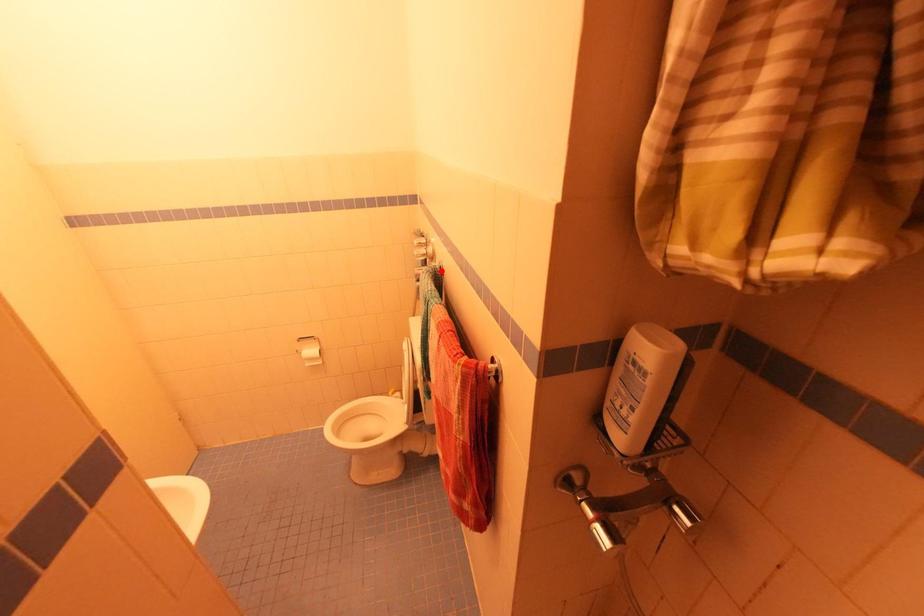
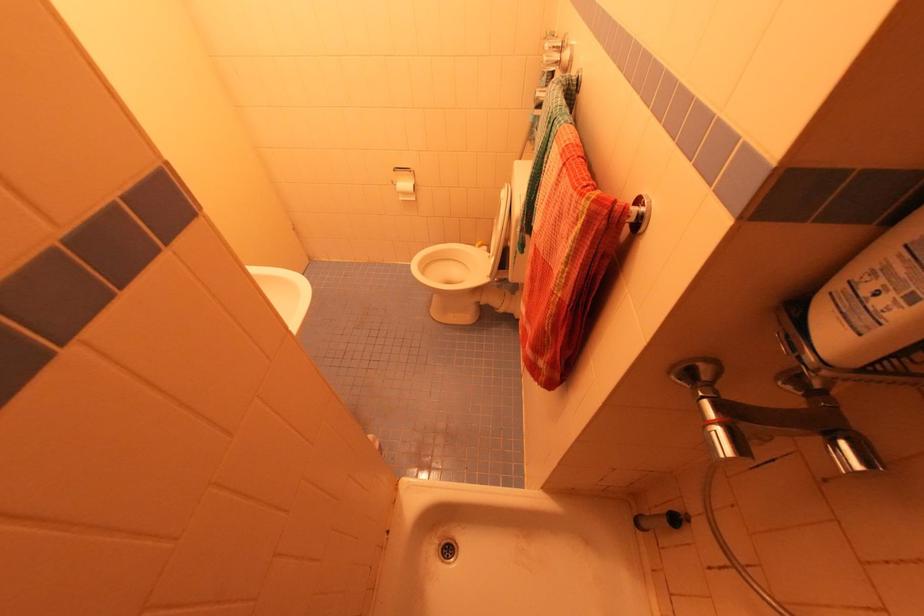
In the second image, find the point that corresponds to the highlighted location in the first image.

(577, 84)